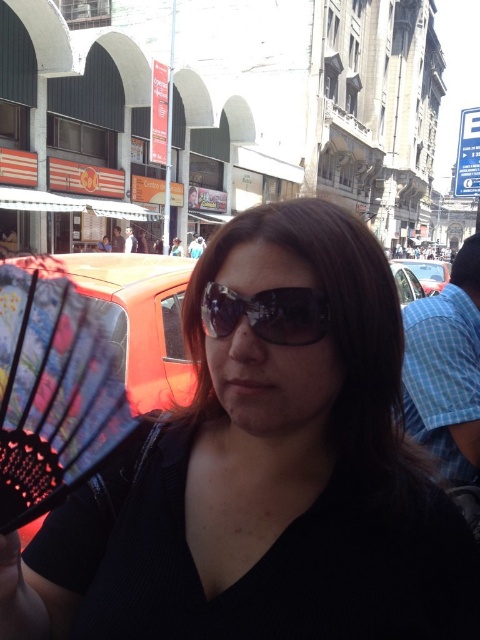
In the scene shown: You are a pedestrian standing on the street and see the black fabric fan at center and the metallic silver car at right. Which object is closer to the ground?

The black fabric fan at center is closer to the ground because it is below the metallic silver car at right.

You are a photographer trying to capture the woman in the scene. You notice the black fabric fan at center and the black reflective sunglasses at center. Which object is closer to the camera to potentially block the view of the other?

The black fabric fan at center is in front of the black reflective sunglasses at center, so it is closer to the camera and could block the view of the sunglasses.